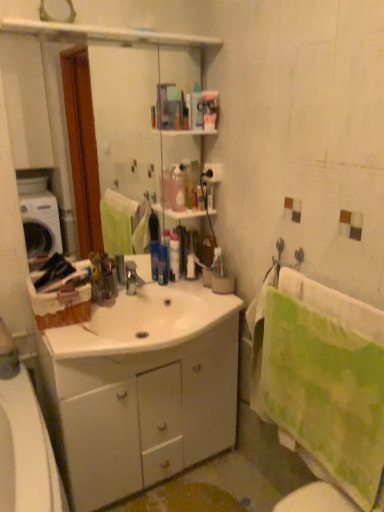
Question: Is blue glossy bottle at center, the 1th toiletry when ordered from left to right, wider than translucent plastic bottle at center, which is the third toiletry in right-to-left order?

Choices:
 (A) no
 (B) yes

Answer: (A)

Question: From the image's perspective, is blue glossy bottle at center, the 4th toiletry positioned from the right, beneath translucent plastic bottle at center, arranged as the 2th toiletry when viewed from the left?

Choices:
 (A) no
 (B) yes

Answer: (B)

Question: Is blue glossy bottle at center, the 1th toiletry when ordered from left to right, at the left side of translucent plastic bottle at center, which is the third toiletry in right-to-left order?

Choices:
 (A) yes
 (B) no

Answer: (A)

Question: Would you say blue glossy bottle at center, the 1th toiletry when ordered from left to right, is a long distance from translucent plastic bottle at center, which is the third toiletry in right-to-left order?

Choices:
 (A) yes
 (B) no

Answer: (B)

Question: Does blue glossy bottle at center, the 1th toiletry when ordered from left to right, come behind translucent plastic bottle at center, arranged as the 2th toiletry when viewed from the left?

Choices:
 (A) no
 (B) yes

Answer: (A)

Question: Can you confirm if blue glossy bottle at center, the 1th toiletry when ordered from left to right, is positioned to the right of translucent plastic bottle at center, which is the third toiletry in right-to-left order?

Choices:
 (A) yes
 (B) no

Answer: (B)

Question: Can we say white glossy cabinet at center lies outside translucent plastic bottle at center, arranged as the 2th toiletry when viewed from the left?

Choices:
 (A) yes
 (B) no

Answer: (A)

Question: Is white glossy cabinet at center with translucent plastic bottle at center, arranged as the 2th toiletry when viewed from the left?

Choices:
 (A) yes
 (B) no

Answer: (B)

Question: Considering the relative sizes of white glossy cabinet at center and translucent plastic bottle at center, which is the third toiletry in right-to-left order, in the image provided, is white glossy cabinet at center shorter than translucent plastic bottle at center, which is the third toiletry in right-to-left order,?

Choices:
 (A) yes
 (B) no

Answer: (B)

Question: From the image's perspective, is white glossy cabinet at center located above translucent plastic bottle at center, arranged as the 2th toiletry when viewed from the left?

Choices:
 (A) yes
 (B) no

Answer: (B)

Question: Can translucent plastic bottle at center, arranged as the 2th toiletry when viewed from the left, be found inside white glossy cabinet at center?

Choices:
 (A) yes
 (B) no

Answer: (B)

Question: Can you confirm if white glossy cabinet at center is bigger than translucent plastic bottle at center, arranged as the 2th toiletry when viewed from the left?

Choices:
 (A) yes
 (B) no

Answer: (A)

Question: Is clear glass mirror at upper center wider than translucent plastic bottle at center, which is the third toiletry in right-to-left order?

Choices:
 (A) yes
 (B) no

Answer: (B)